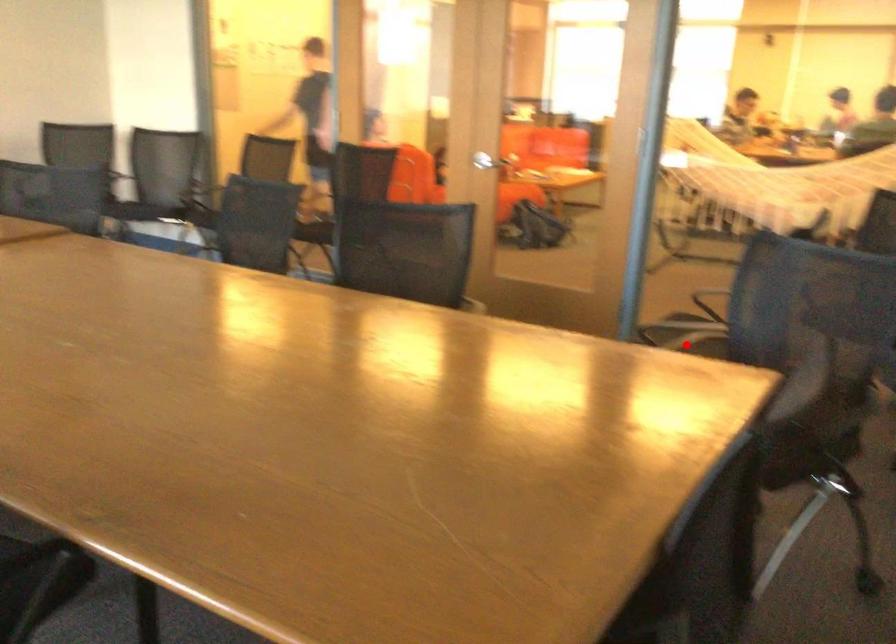
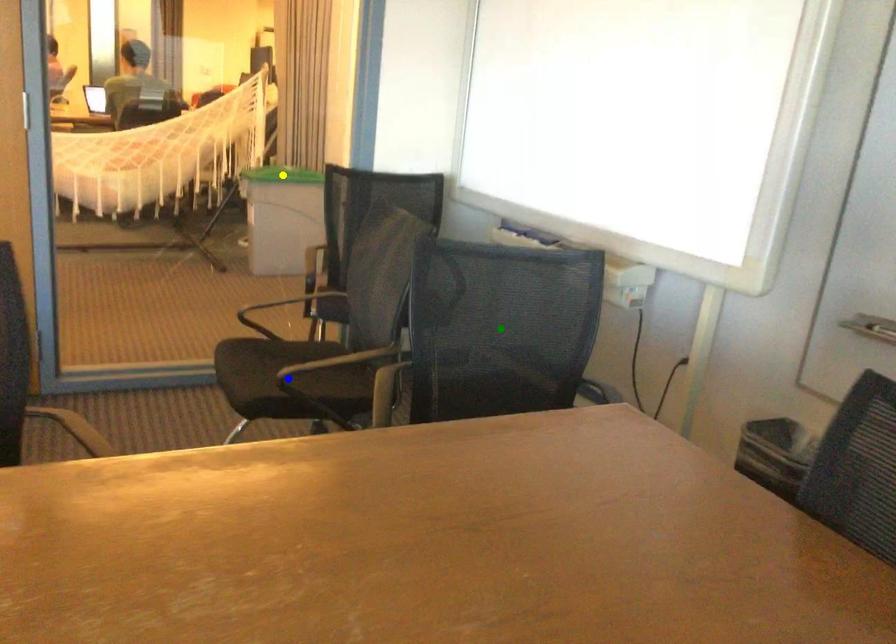
Question: I am providing you with two images of the same scene from different viewpoints. A red point is marked on the first image. You are given multiple points on the second image. Which mark in image 2 goes with the point in image 1?

Choices:
 (A) blue point
 (B) yellow point
 (C) green point

Answer: (A)